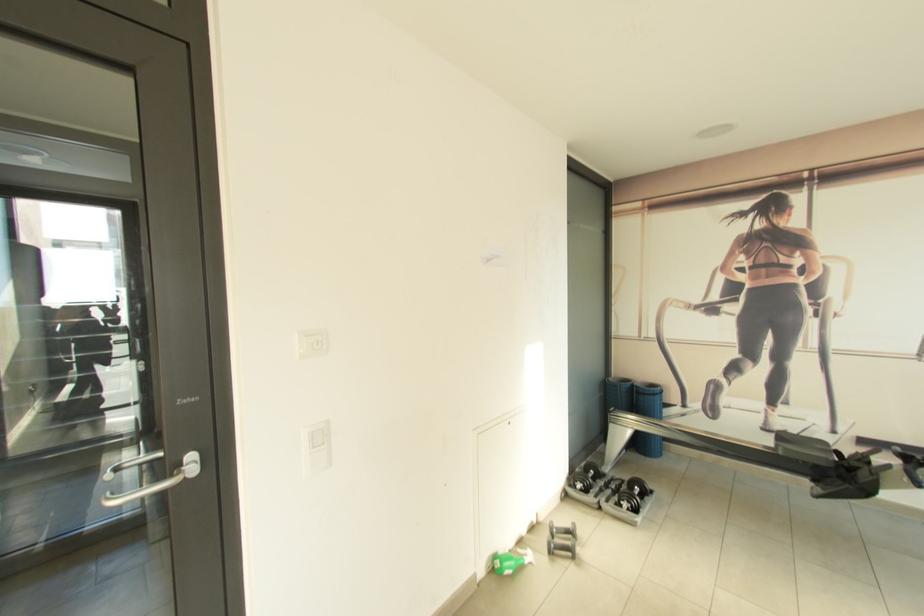
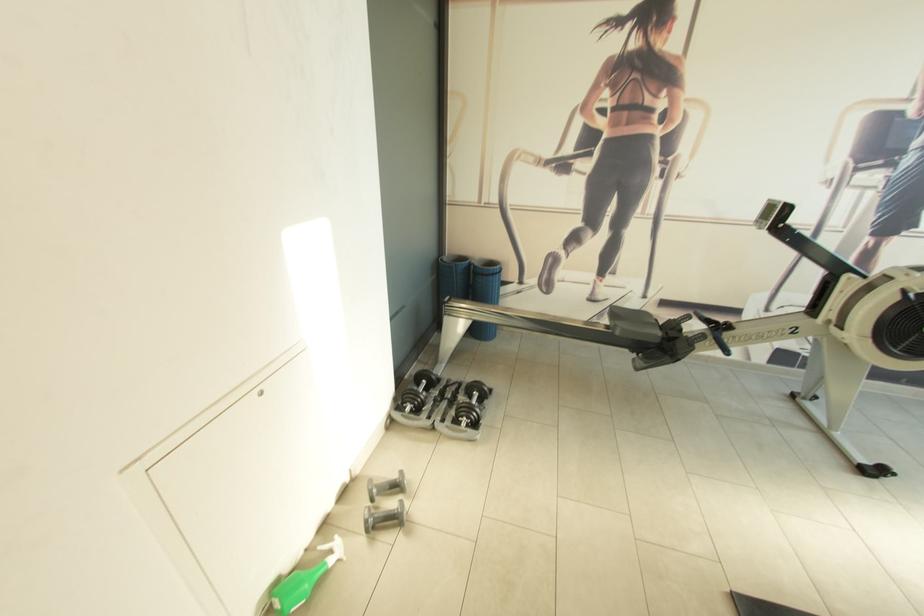
In the second image, find the point that corresponds to [785,454] in the first image.

(622, 334)